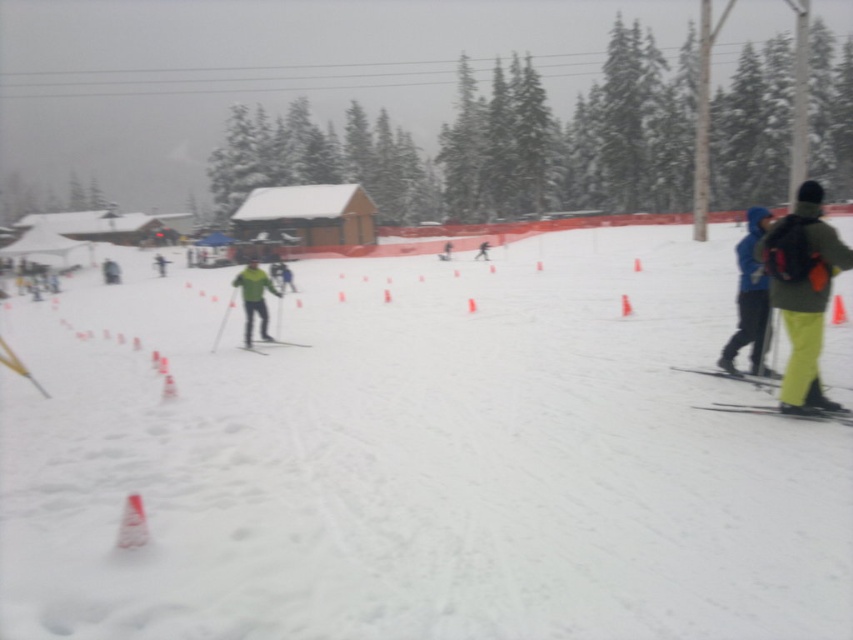
Question: Is green matte jacket at center to the left of yellow matte ski at lower right from the viewer's perspective?

Choices:
 (A) yes
 (B) no

Answer: (A)

Question: Which of these objects is positioned closest to the white snow ski slope at center?

Choices:
 (A) blue fleece jacket at right
 (B) green matte jacket at center
 (C) green fabric jacket at right
 (D) yellow matte ski at lower right

Answer: (B)

Question: Can you confirm if blue fleece jacket at right is positioned below matte green ski at center?

Choices:
 (A) no
 (B) yes

Answer: (A)

Question: Among these points, which one is farthest from the camera?

Choices:
 (A) (749, 224)
 (B) (799, 412)
 (C) (751, 406)
 (D) (22, 596)

Answer: (A)

Question: Which object is positioned closest to the white snow ski slope at center?

Choices:
 (A) green fabric jacket at right
 (B) green matte jacket at center
 (C) yellow matte ski at lower right

Answer: (B)

Question: Can you confirm if green fabric jacket at right is positioned to the left of blue fleece jacket at right?

Choices:
 (A) no
 (B) yes

Answer: (B)